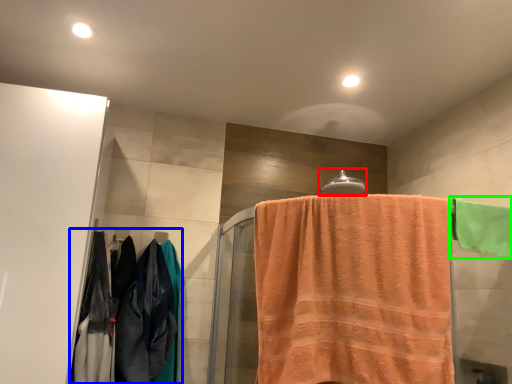
Question: Estimate the real-world distances between objects in this image. Which object is closer to towel bar (highlighted by a red box), clothing (highlighted by a blue box) or towel (highlighted by a green box)?

Choices:
 (A) clothing
 (B) towel

Answer: (B)